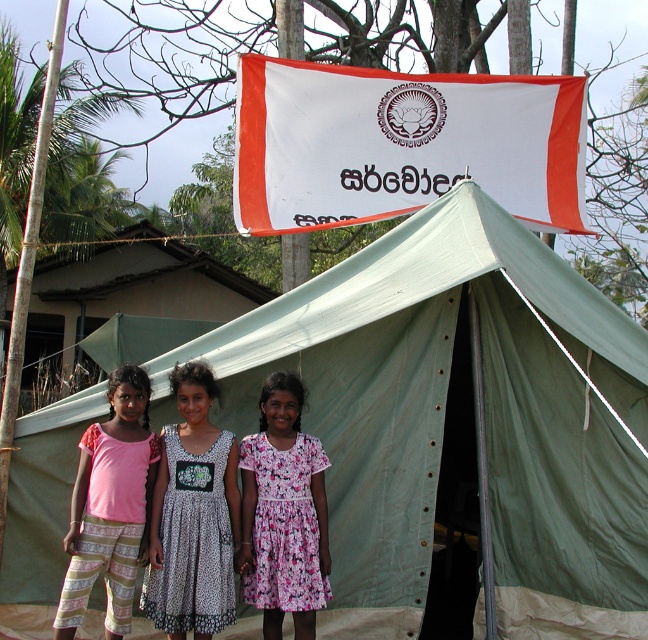
Question: Where is whitematerial/textureflag at upper center located in relation to floral cotton dress at center in the image?

Choices:
 (A) below
 (B) above

Answer: (B)

Question: Is the position of whitematerial/textureflag at upper center more distant than that of white dotted dress at center?

Choices:
 (A) yes
 (B) no

Answer: (A)

Question: Does green canvas tent at center have a smaller size compared to whitematerial/textureflag at upper center?

Choices:
 (A) yes
 (B) no

Answer: (B)

Question: Considering the real-world distances, which object is farthest from the light pink fabric pants at lower left?

Choices:
 (A) white dotted dress at center
 (B) green canvas tent at center
 (C) whitematerial/textureflag at upper center
 (D) floral cotton dress at center

Answer: (C)

Question: Considering the real-world distances, which object is closest to the white dotted dress at center?

Choices:
 (A) whitematerial/textureflag at upper center
 (B) light pink fabric pants at lower left
 (C) green canvas tent at center
 (D) floral cotton dress at center

Answer: (B)

Question: Which of the following is the farthest from the observer?

Choices:
 (A) (334, 497)
 (B) (159, 592)
 (C) (130, 460)
 (D) (279, 568)

Answer: (A)